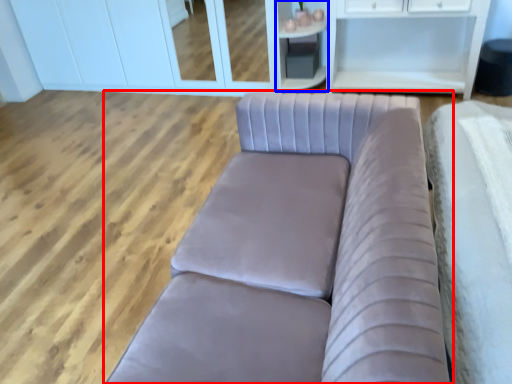
Question: Among these objects, which one is farthest to the camera, studio couch (highlighted by a red box) or cabinetry (highlighted by a blue box)?

Choices:
 (A) studio couch
 (B) cabinetry

Answer: (B)